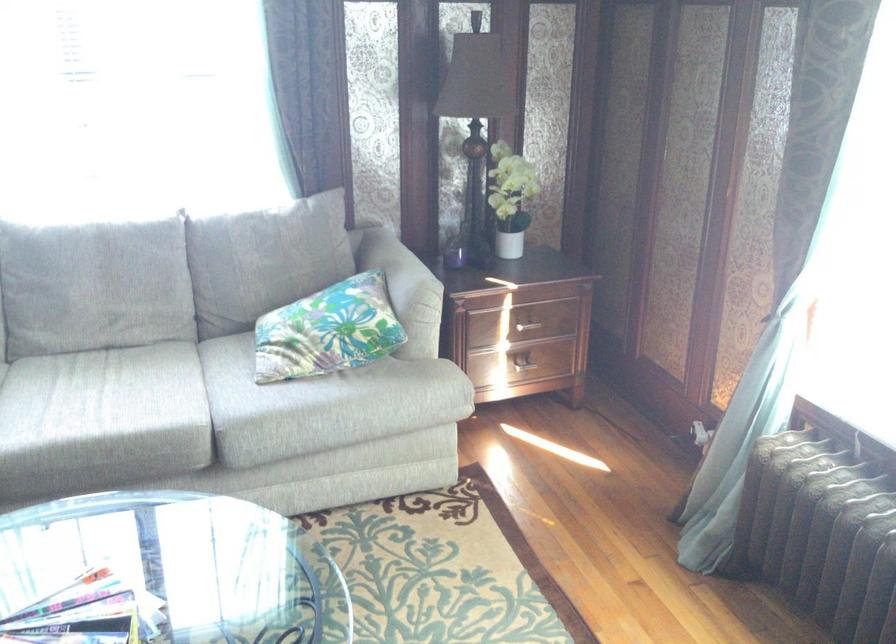
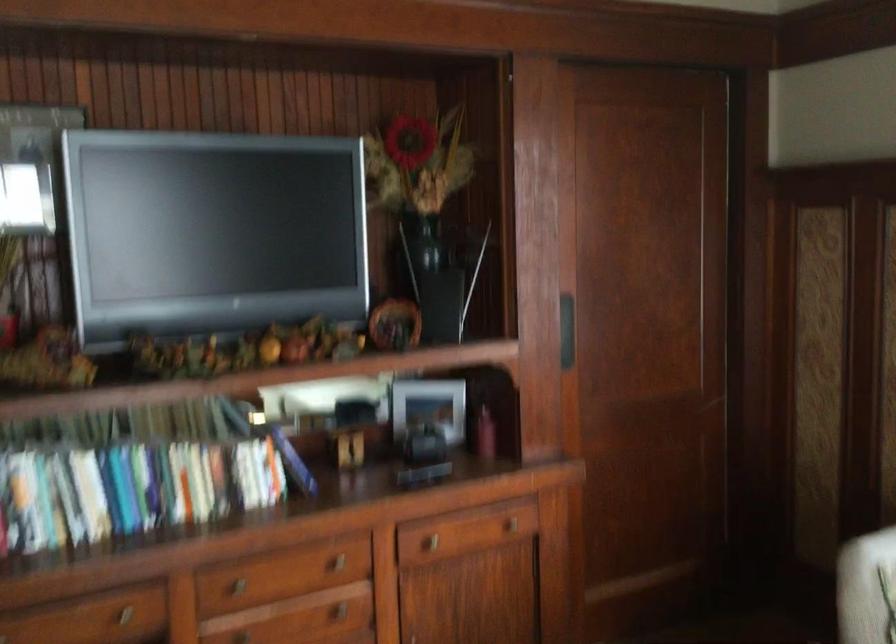
Question: The images are taken continuously from a first-person perspective. In which direction is your viewpoint rotating?

Choices:
 (A) Left
 (B) Right
 (C) Up
 (D) Down

Answer: (A)